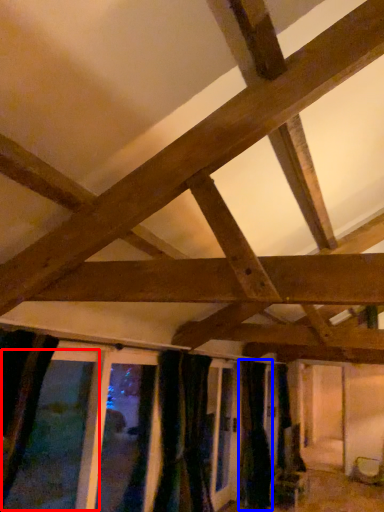
Question: Which object is further to the camera taking this photo, window (highlighted by a red box) or curtain (highlighted by a blue box)?

Choices:
 (A) window
 (B) curtain

Answer: (B)